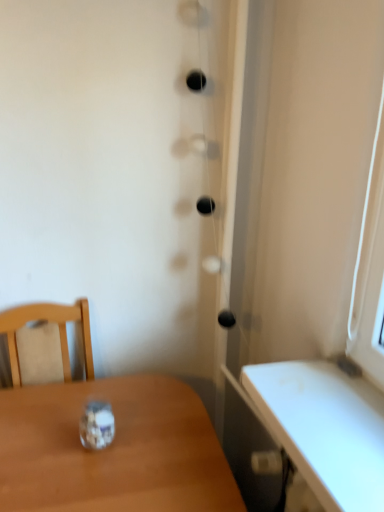
Question: Would you say wooden table at lower left is to the left or to the right of clear glass jar at center in the picture?

Choices:
 (A) right
 (B) left

Answer: (A)

Question: Choose the correct answer: Is wooden table at lower left inside clear glass jar at center or outside it?

Choices:
 (A) outside
 (B) inside

Answer: (A)

Question: From a real-world perspective, is wooden table at lower left physically located above or below clear glass jar at center?

Choices:
 (A) below
 (B) above

Answer: (A)

Question: Is clear glass jar at center in front of or behind wooden table at lower left in the image?

Choices:
 (A) behind
 (B) front

Answer: (A)

Question: From a real-world perspective, is clear glass jar at center above or below wooden table at lower left?

Choices:
 (A) below
 (B) above

Answer: (B)

Question: Would you say clear glass jar at center is inside or outside wooden table at lower left?

Choices:
 (A) outside
 (B) inside

Answer: (A)

Question: In terms of size, does clear glass jar at center appear bigger or smaller than wooden table at lower left?

Choices:
 (A) big
 (B) small

Answer: (B)